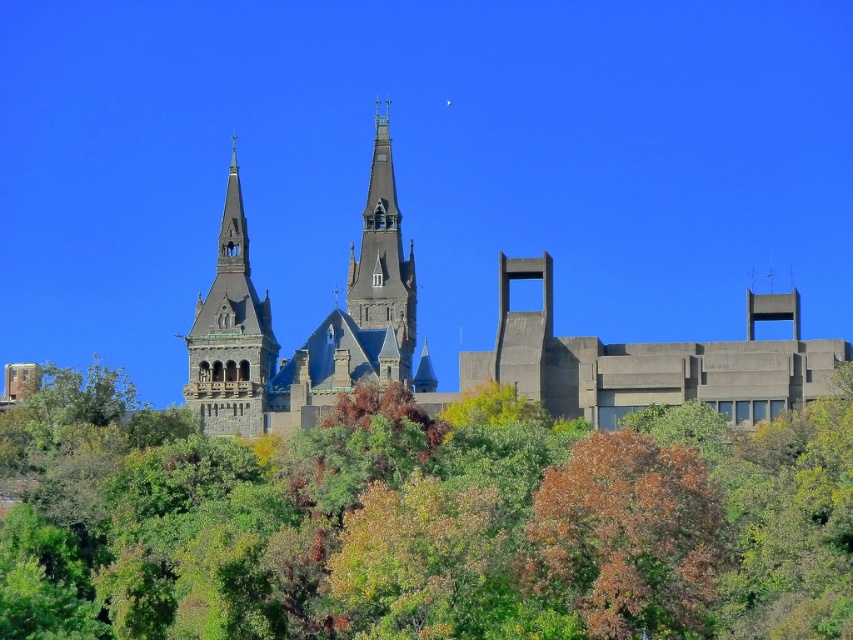
Question: Which object is the farthest from the brown leafy tree at lower center?

Choices:
 (A) green leafy tree at center
 (B) dark gray stone church at center

Answer: (B)

Question: From the image, what is the correct spatial relationship of dark gray stone church at center in relation to smooth gray stone tower at center?

Choices:
 (A) above
 (B) below

Answer: (A)

Question: Can you confirm if brown leafy tree at lower center is wider than smooth gray stone tower at center?

Choices:
 (A) no
 (B) yes

Answer: (B)

Question: Does dark gray stone church at center have a lesser width compared to smooth gray stone tower at center?

Choices:
 (A) no
 (B) yes

Answer: (A)

Question: Considering the real-world distances, which object is farthest from the dark gray stone church at center?

Choices:
 (A) smooth gray stone tower at center
 (B) stone gothic tower at upper left
 (C) green leafy tree at center
 (D) brown leafy tree at lower center

Answer: (D)

Question: Which of the following is the closest to the observer?

Choices:
 (A) coord(364,300)
 (B) coord(666,512)
 (C) coord(473,371)

Answer: (B)